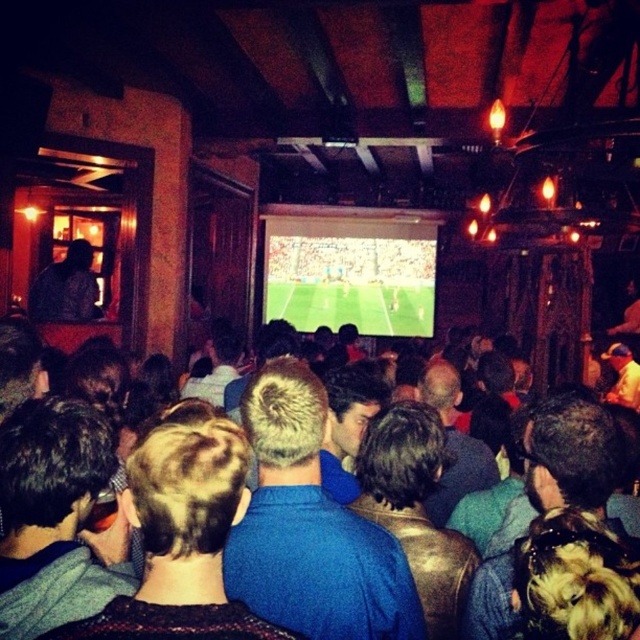
You are a photographer at the sports bar and want to take a photo of the white glossy screen at center without any obstructions. However, there is a dark brown leather jacket at center in the way. Can you adjust your position to capture the screen fully?

The white glossy screen at center is wider than the dark brown leather jacket at center, so you can move to the side to capture the entire screen while avoiding the jacket.

You are a photographer at the sports bar and want to capture a photo of both the short blonde hair at center and the dark brown leather jacket at center. Since you want both subjects to be clearly visible, which one should you focus on first to ensure proper framing?

The short blonde hair at center has a lesser width compared to dark brown leather jacket at center, so you should focus on the dark brown leather jacket at center first to ensure it fits properly in the frame.